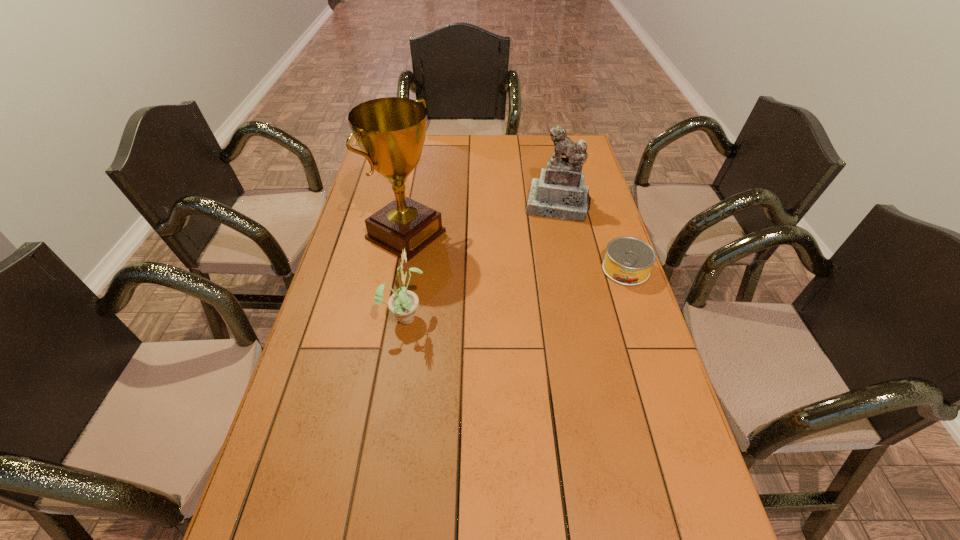
You are a GUI agent. You are given a task and a screenshot of the screen. Output one action in this format:
    pyautogui.click(x=<x>, y=<y>)
    Task: Click on the vacant space that satisfies the following two spatial constraints: 1. on the front side of the figurine; 2. on the left side of the shortest object
    This screenshot has height=540, width=960.
    Given the screenshot: What is the action you would take?
    pyautogui.click(x=573, y=269)

Find the location of a particular element. Image resolution: width=960 pixels, height=540 pixels. free space that satisfies the following two spatial constraints: 1. on the front side of the can; 2. on the right side of the award is located at coordinates (399, 269).